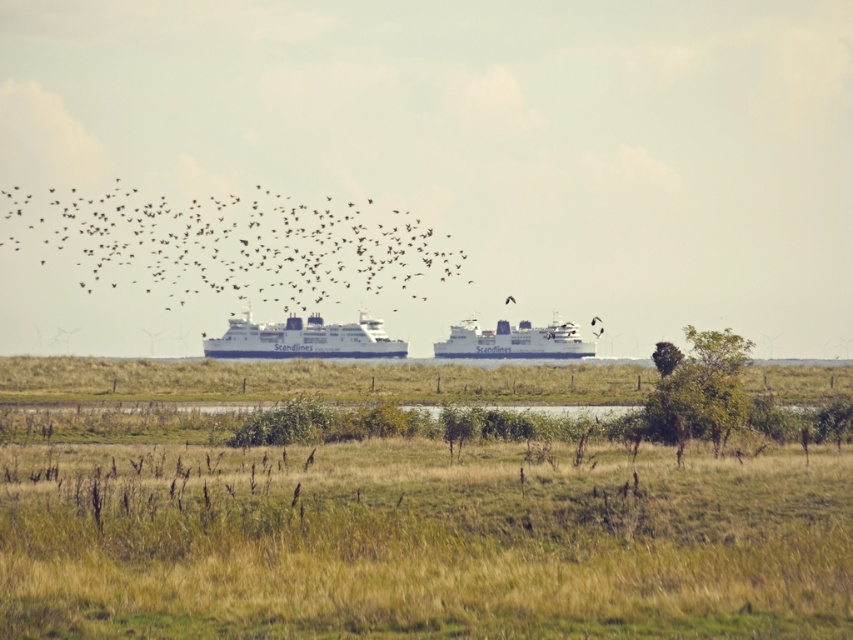
Is black matte birds at upper center to the right of white matte ferry at center from the viewer's perspective?

No, black matte birds at upper center is not to the right of white matte ferry at center.

Locate an element on the screen. black matte birds at upper center is located at coordinates (227, 243).

Identify the location of black matte birds at upper center. (227, 243).

Who is positioned more to the right, white matte ferry at center or dark brown feathered bird at upper center?

dark brown feathered bird at upper center

Can you confirm if white matte ferry at center is positioned below dark brown feathered bird at upper center?

Correct, white matte ferry at center is located below dark brown feathered bird at upper center.

Image resolution: width=853 pixels, height=640 pixels. In order to click on white matte ferry at center in this screenshot , I will do `click(514, 340)`.

Is black matte bird at center wider than dark brown feathered bird at upper center?

Indeed, black matte bird at center has a greater width compared to dark brown feathered bird at upper center.

Is point (592, 321) closer to viewer compared to point (509, 296)?

Yes.

Locate an element on the screen. The height and width of the screenshot is (640, 853). black matte bird at center is located at coordinates (595, 321).